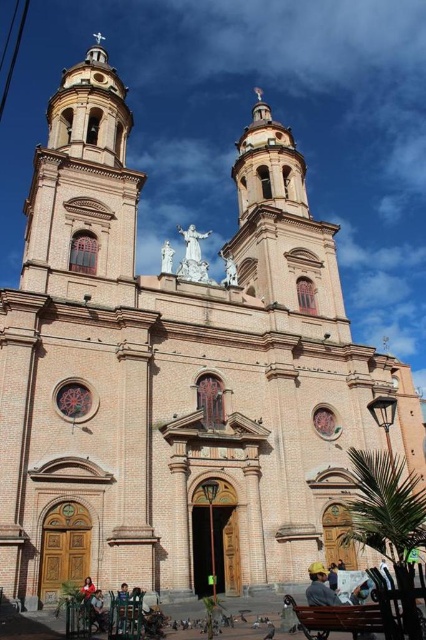
Question: Is white marble statue at center behind reddish-brown leather jacket at lower center?

Choices:
 (A) yes
 (B) no

Answer: (A)

Question: Which point is farther to the camera?

Choices:
 (A) white marble statue at center
 (B) brown wooden bench at lower center

Answer: (A)

Question: Is brown wooden bench at lower center above reddish-brown leather jacket at lower center?

Choices:
 (A) yes
 (B) no

Answer: (A)

Question: Does brown wooden bench at lower center come in front of reddish-brown leather jacket at lower center?

Choices:
 (A) no
 (B) yes

Answer: (B)

Question: Which object appears closest to the camera in this image?

Choices:
 (A) brown wooden bench at lower center
 (B) white marble statue at center
 (C) reddish-brown leather jacket at lower center

Answer: (A)

Question: Which object is the farthest from the brown wooden bench at lower center?

Choices:
 (A) white marble statue at center
 (B) reddish-brown leather jacket at lower center

Answer: (A)